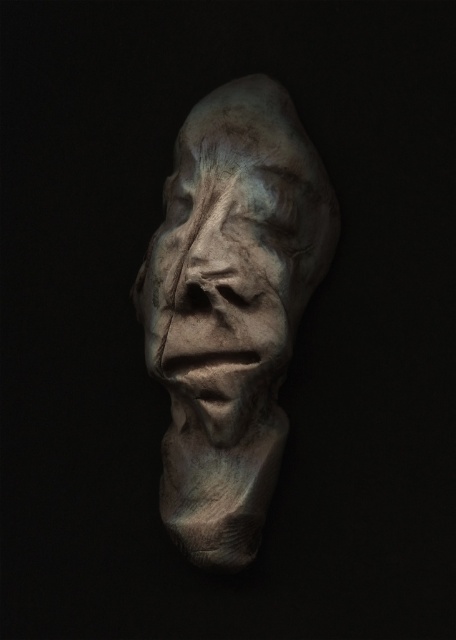
You are an art conservator working with a precision tool that requires a minimum of 0.5 inches of space to operate. You need to work on both the matte stone sculpture at center and the matte stone face at center. Is there enough space between them to use your tool?

The matte stone sculpture at center is 0.67 inches away from the matte stone face at center, which is more than the required 0.5 inches of space. Therefore, there is enough space to use the precision tool between them.

You are an art curator examining the sculpture. You notice two elements, the matte stone sculpture at center and the matte stone face at center. Which one is located below the other?

The matte stone sculpture at center is positioned under the matte stone face at center, so the sculpture is below the face.

You are an art conservator examining the sculpture. You notice two points on the sculpture at coordinates point (214, 204) and point (255, 314). Which point is closer to the viewer?

Point (255, 314) is closer to the viewer because the description states that point (214, 204) is behind it.